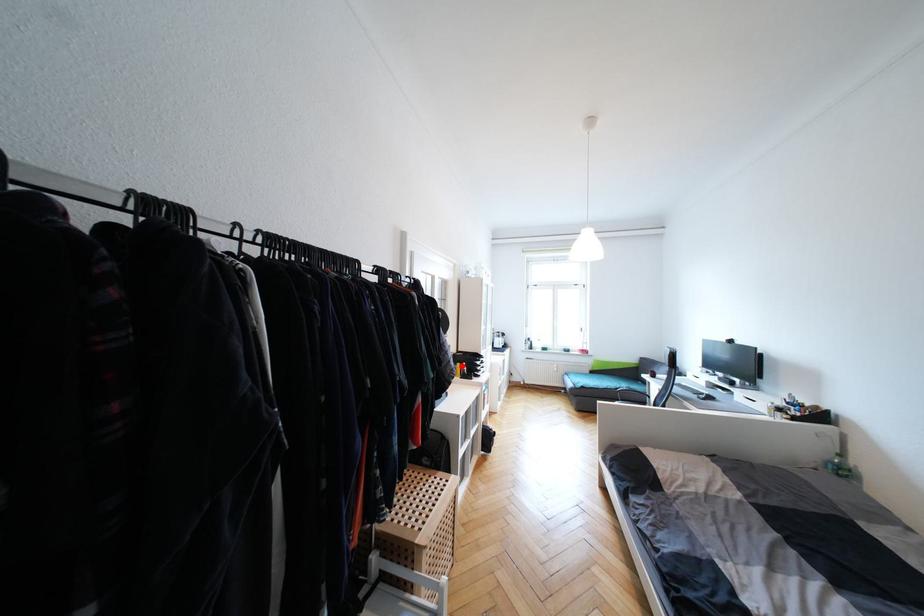
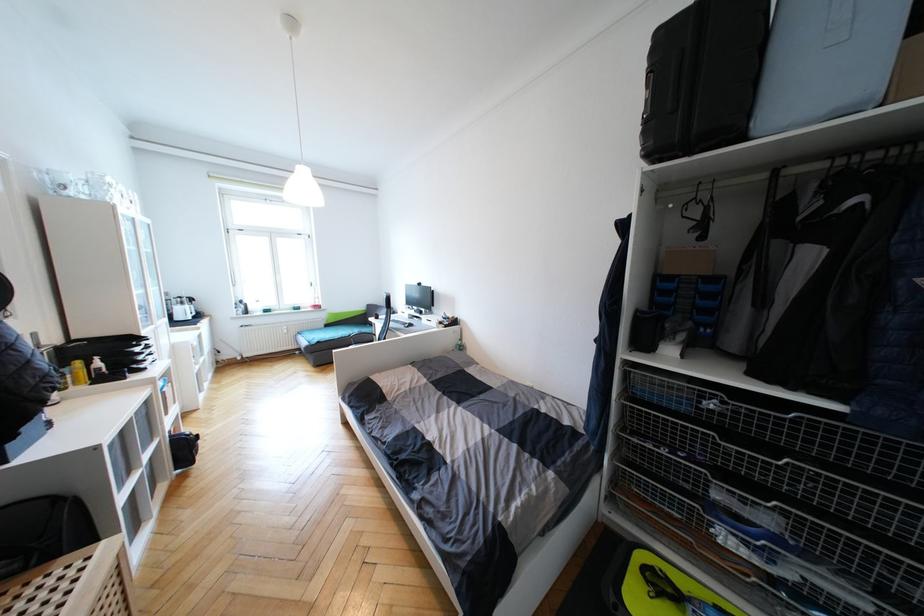
Question: I am providing you with two images of the same scene from different viewpoints. A red point is shown in image1. For the corresponding object point in image2, is it positioned nearer or farther from the camera?

Choices:
 (A) Nearer
 (B) Farther

Answer: (B)